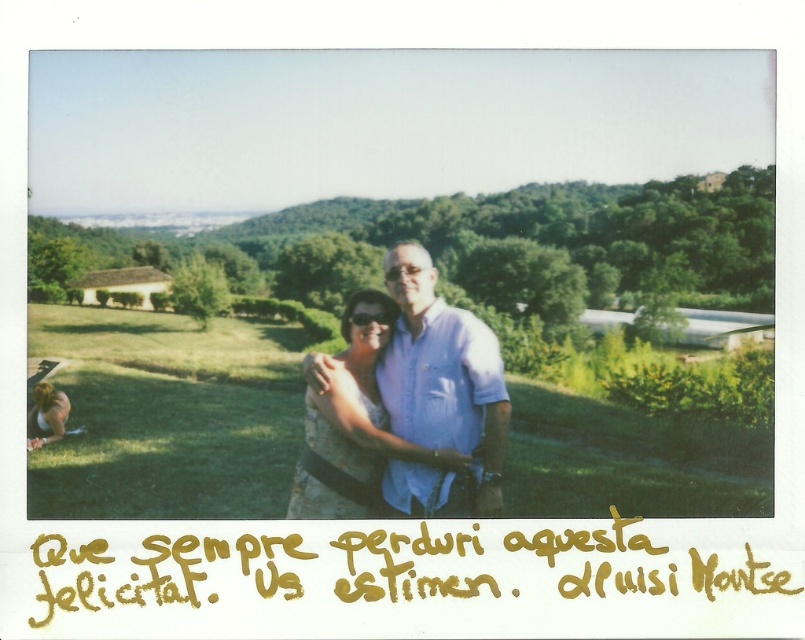
Can you confirm if matte blue shirt at center is bigger than matte white dress at lower left?

Yes, matte blue shirt at center is bigger than matte white dress at lower left.

Image resolution: width=805 pixels, height=640 pixels. Find the location of `matte blue shirt at center`. matte blue shirt at center is located at coordinates pos(430,394).

Locate an element on the screen. This screenshot has height=640, width=805. matte blue shirt at center is located at coordinates (430, 394).

This screenshot has height=640, width=805. Identify the location of matte blue shirt at center. (430, 394).